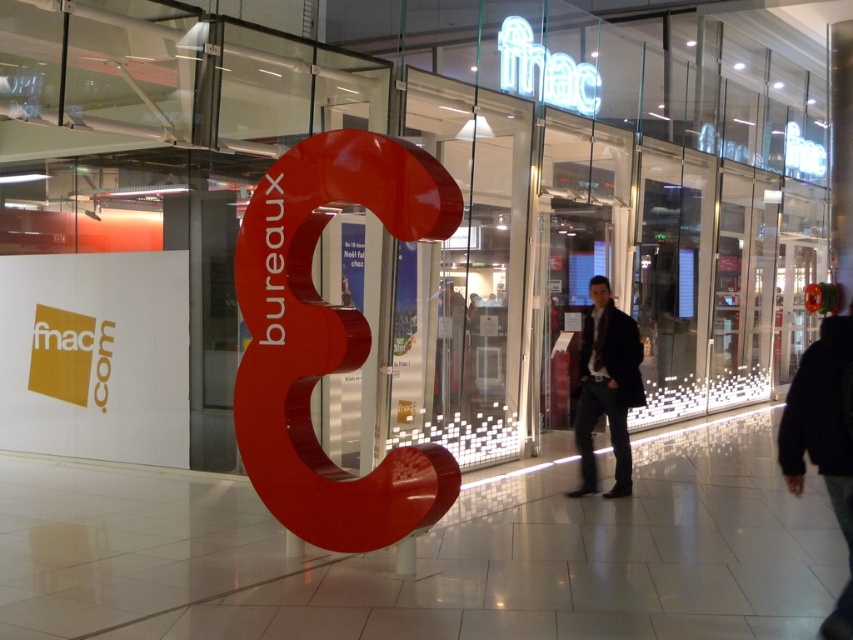
You are a store employee who needs to retrieve a black fabric jacket at lower right and a dark brown leather jacket at center for a customer. If you are currently standing at the entrance, which jacket is closer to you?

The black fabric jacket at lower right is closer to you since it is only 8.91 feet away from the dark brown leather jacket at center, implying that both jackets are near each other but the black one is slightly nearer to the entrance.

You are a customer standing at the entrance of the mall and see both the black fabric jacket at lower right and the dark brown leather jacket at center. Which jacket is shorter in height?

The black fabric jacket at lower right is shorter than the dark brown leather jacket at center.